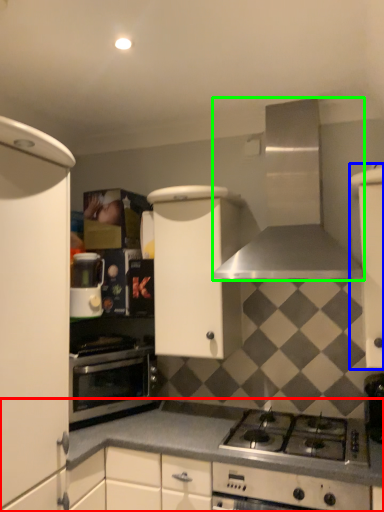
Question: Considering the real-world distances, which object is farthest from countertop (highlighted by a red box)? cabinetry (highlighted by a blue box) or kitchen appliance (highlighted by a green box)?

Choices:
 (A) cabinetry
 (B) kitchen appliance

Answer: (B)